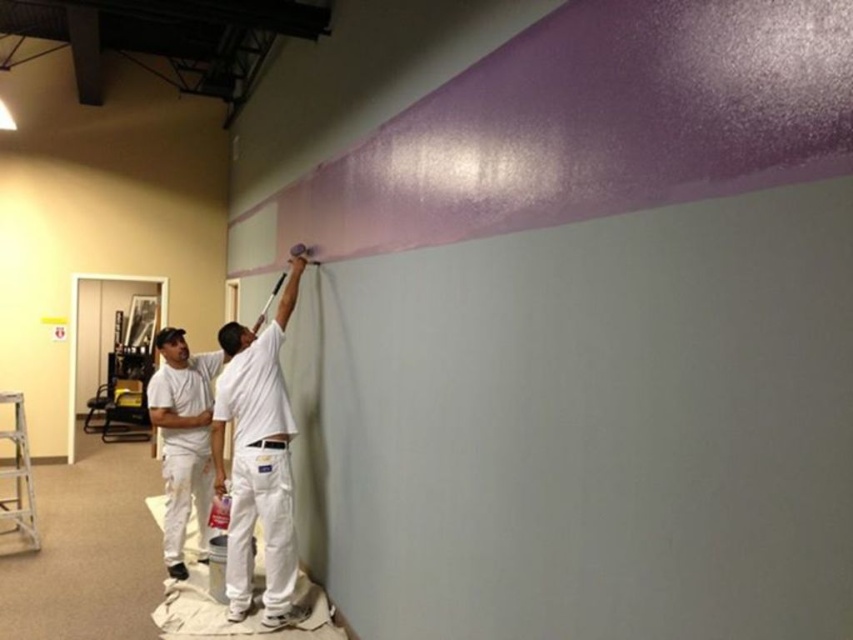
Is white matte shirt at upper center shorter than white matte paint at lower left?

No.

Is point (279, 410) positioned in front of point (218, 353)?

Yes, point (279, 410) is closer to viewer.

Where is `white matte shirt at upper center`? Image resolution: width=853 pixels, height=640 pixels. white matte shirt at upper center is located at coordinates (257, 460).

Who is lower down, white matte paint at lower left or aluminum metallic ladder at lower left?

aluminum metallic ladder at lower left

Which of these two, white matte paint at lower left or aluminum metallic ladder at lower left, stands shorter?

With less height is aluminum metallic ladder at lower left.

Does point (173, 344) come in front of point (22, 490)?

That is True.

Locate an element on the screen. white matte paint at lower left is located at coordinates (183, 438).

Who is positioned more to the left, white matte shirt at upper center or aluminum metallic ladder at lower left?

Positioned to the left is aluminum metallic ladder at lower left.

Is white matte shirt at upper center further to the viewer compared to aluminum metallic ladder at lower left?

That is False.

Is point (252, 438) in front of point (15, 490)?

Yes, it is in front of point (15, 490).

You are a GUI agent. You are given a task and a screenshot of the screen. Output one action in this format:
    pyautogui.click(x=<x>, y=<y>)
    Task: Click on the white matte shirt at upper center
    Image resolution: width=853 pixels, height=640 pixels.
    Given the screenshot: What is the action you would take?
    pyautogui.click(x=257, y=460)